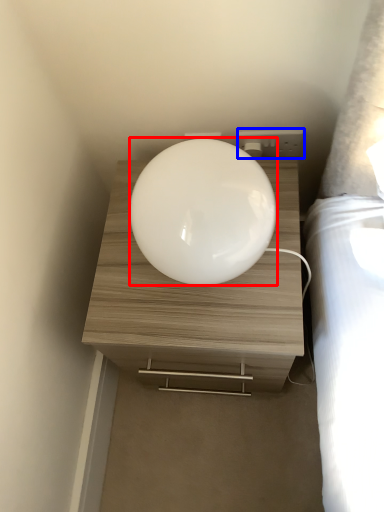
Question: Which object appears closest to the camera in this image, oval (highlighted by a red box) or electric outlet (highlighted by a blue box)?

Choices:
 (A) oval
 (B) electric outlet

Answer: (A)